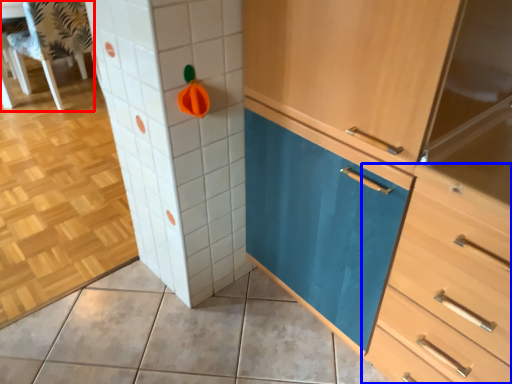
Question: Which object appears farthest to the camera in this image, chair (highlighted by a red box) or chest of drawers (highlighted by a blue box)?

Choices:
 (A) chair
 (B) chest of drawers

Answer: (A)